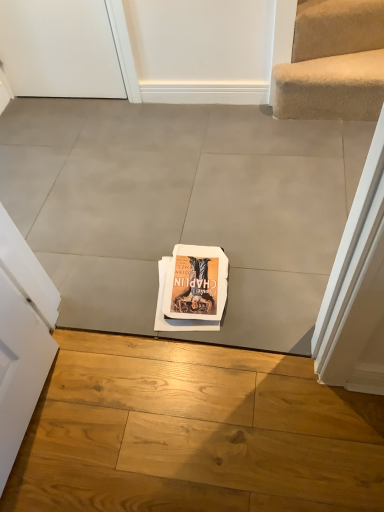
Identify the location of free location above matte paper book at center (from a real-world perspective). This screenshot has height=512, width=384. (179, 306).